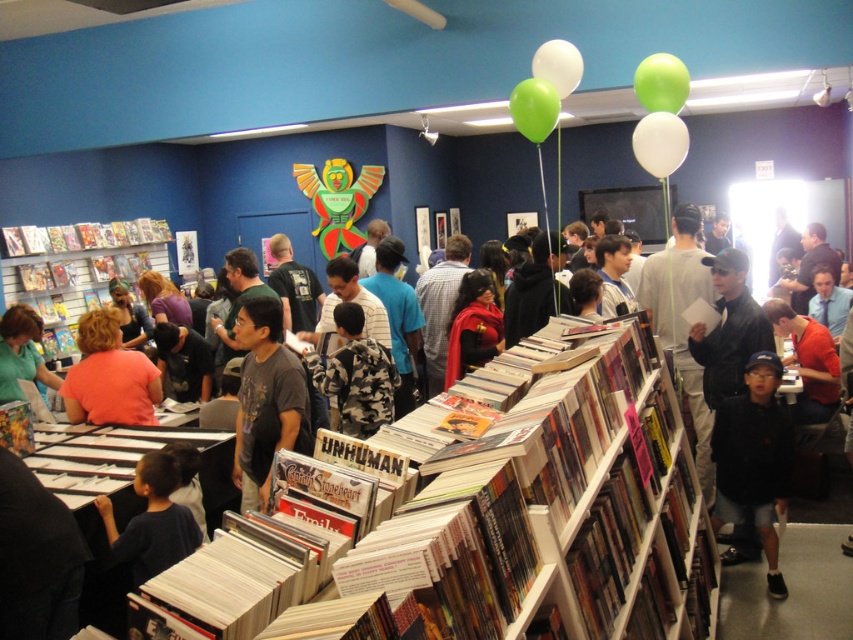
In the scene shown: You are a customer in the comic store and want to grab both the hardcover books at center and the green rubber balloon at upper right. Which object should you move towards first if you are standing at the entrance near the left wall?

The hardcover books at center is to the left of green rubber balloon at upper right, so you should move towards the hardcover books at center first since it is closer to your current position near the left wall.

What object is located at the coordinates point (532,499)?

The point (532,499) corresponds to hardcover books at center.

You are a customer in the comic book store and see two balloons at the top of the image. You want to know if they are close enough to tie together with a ribbon. The ribbon you have is 5 inches long. Can the ribbon reach between the green rubber balloon at upper center and the white rubber balloon at upper center?

The green rubber balloon at upper center is 4.91 inches from the white rubber balloon at upper center. Since the ribbon is 5 inches long, it can easily reach between them.